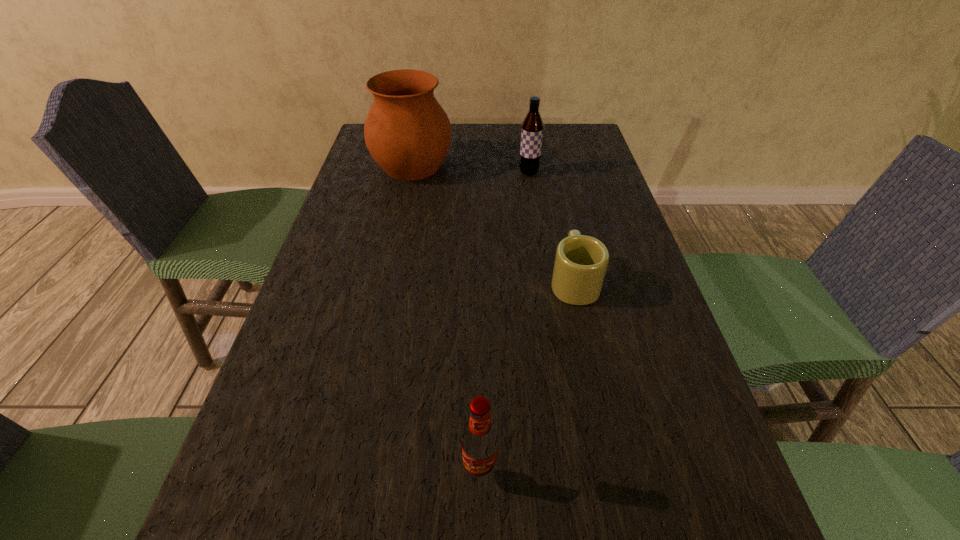
Where is `pottery`? pottery is located at coordinates (407, 132).

I want to click on the right root beer, so click(532, 127).

The image size is (960, 540). I want to click on the nearer root beer, so click(480, 441).

Locate an element on the screen. This screenshot has height=540, width=960. the third tallest object is located at coordinates (480, 441).

This screenshot has width=960, height=540. What are the coordinates of `the third farthest object` in the screenshot? It's located at (581, 261).

At what (x,y) coordinates should I click in order to perform the action: click on mug. Please return your answer as a coordinate pair (x, y). Image resolution: width=960 pixels, height=540 pixels. Looking at the image, I should click on (581, 261).

This screenshot has width=960, height=540. I want to click on free space located on the front of the leftmost object, so click(x=396, y=242).

This screenshot has height=540, width=960. Find the location of `vacant space located 0.080m on the right of the right root beer`. vacant space located 0.080m on the right of the right root beer is located at coordinates (565, 173).

In order to click on vacant area located on the back of the third tallest object in this screenshot , I will do `click(480, 343)`.

This screenshot has width=960, height=540. Identify the location of free space located 0.300m with the handle on the side of the shortest object. (554, 189).